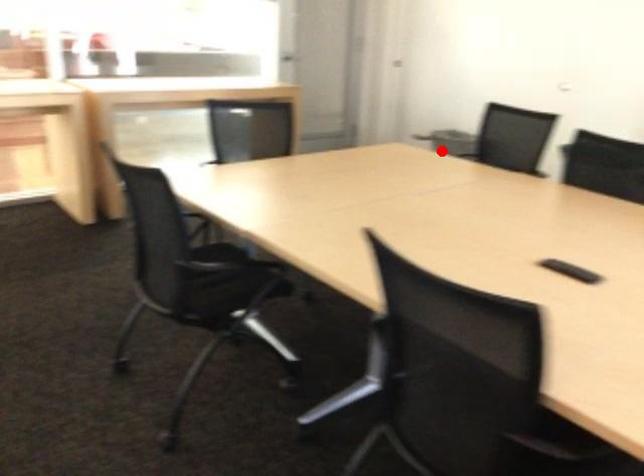
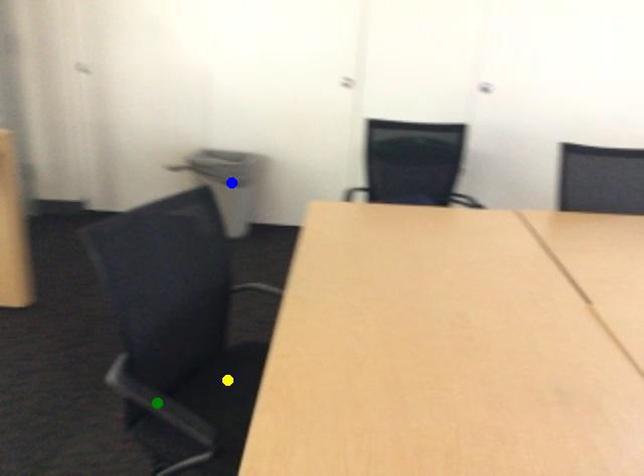
Question: I am providing you with two images of the same scene from different viewpoints. A red point is marked on the first image. You are given multiple points on the second image. Which point in image 2 represents the same 3d spot as the red point in image 1?

Choices:
 (A) yellow point
 (B) blue point
 (C) green point

Answer: (B)